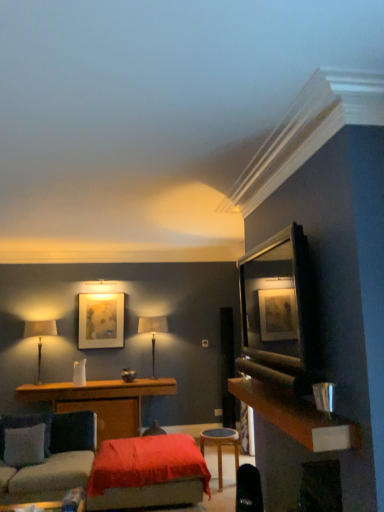
Question: Is point (107, 419) closer or farther from the camera than point (157, 466)?

Choices:
 (A) farther
 (B) closer

Answer: (A)

Question: Is wooden table at center, which is counted as the 1th table, starting from the left, bigger or smaller than velvet red ottoman at center?

Choices:
 (A) big
 (B) small

Answer: (A)

Question: Based on their relative distances, which object is nearer to the matte black table lamp at center, positioned as the second table lamp in left-to-right order?

Choices:
 (A) wooden framed mirror at upper right
 (B) wooden stool at center, the 1th table from the right
 (C) white fabric pillow at lower left
 (D) velvet red ottoman at center
 (E) matte gold picture frame at upper center

Answer: (E)

Question: Which is farther from the wooden framed mirror at upper right?

Choices:
 (A) matte gold picture frame at upper center
 (B) white fabric pillow at lower left
 (C) velvet blue couch at lower left
 (D) wooden stool at center, the 1th table viewed from the front
 (E) matte black table lamp at center, the 1th table lamp viewed from the right

Answer: (E)